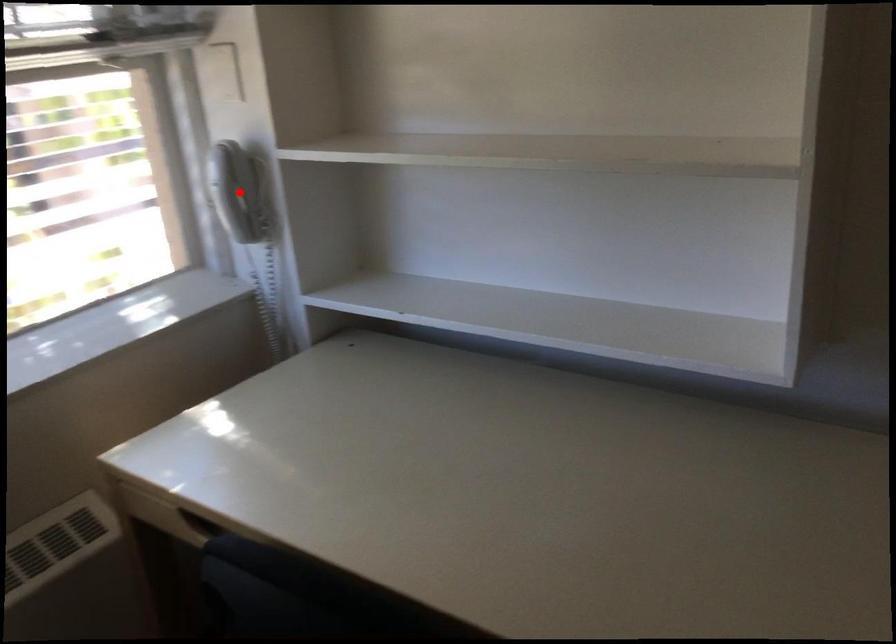
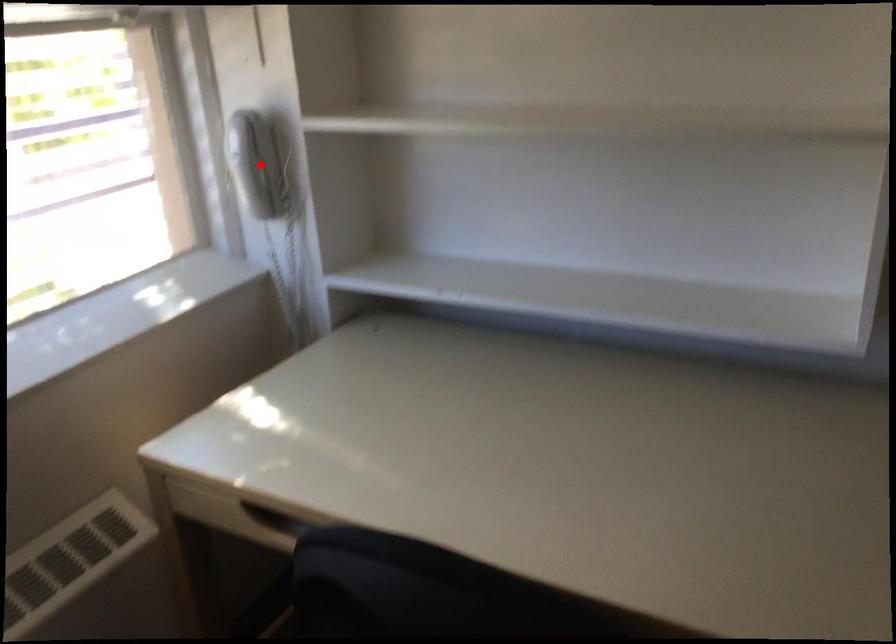
I am providing you with two images of the same scene from different viewpoints. A red point is marked on the first image and another point is marked on the second image. Does the point marked in image1 correspond to the same location as the one in image2?

Yes